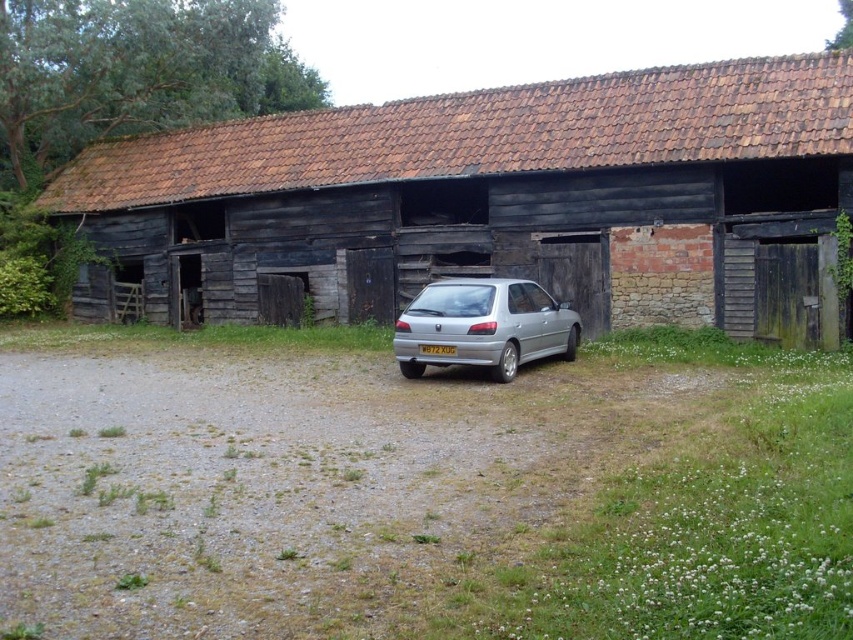
Question: Which point appears farthest from the camera in this image?

Choices:
 (A) (448, 362)
 (B) (424, 344)

Answer: (B)

Question: Is rustic wooden barn at center behind white plastic license plate at center?

Choices:
 (A) yes
 (B) no

Answer: (A)

Question: Among these objects, which one is nearest to the camera?

Choices:
 (A) rustic wooden barn at center
 (B) white plastic license plate at center

Answer: (B)

Question: Does rustic wooden barn at center have a larger size compared to white plastic license plate at center?

Choices:
 (A) no
 (B) yes

Answer: (B)

Question: Can you confirm if rustic wooden barn at center is thinner than silver metallic hatchback at center?

Choices:
 (A) yes
 (B) no

Answer: (B)

Question: Which of the following is the closest to the observer?

Choices:
 (A) 479,260
 (B) 447,346
 (C) 490,280

Answer: (B)